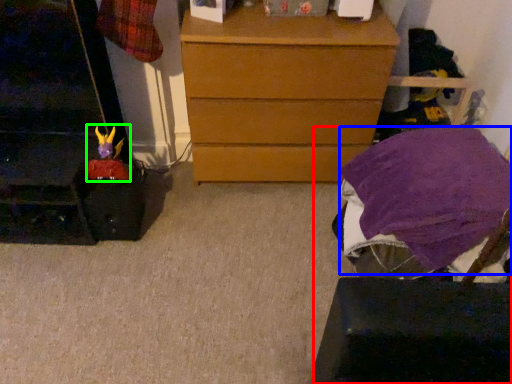
Question: Considering the real-world distances, which object is closest to furniture (highlighted by a red box)? blanket (highlighted by a blue box) or toy (highlighted by a green box).

Choices:
 (A) blanket
 (B) toy

Answer: (A)